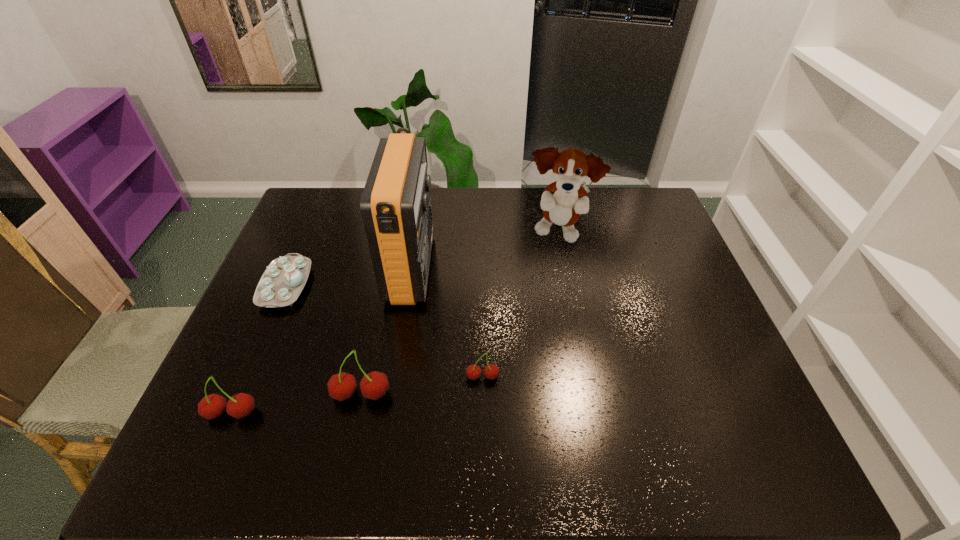
The height and width of the screenshot is (540, 960). Identify the location of vacant space located 0.400m on the front-facing side of the radio receiver. (564, 268).

The image size is (960, 540). Find the location of `vacant space located 0.050m on the right of the chinaware`. vacant space located 0.050m on the right of the chinaware is located at coordinates pyautogui.click(x=326, y=285).

You are a GUI agent. You are given a task and a screenshot of the screen. Output one action in this format:
    pyautogui.click(x=<x>, y=<y>)
    Task: Click on the object located at the far edge
    This screenshot has height=540, width=960.
    Given the screenshot: What is the action you would take?
    pyautogui.click(x=562, y=202)

Find the location of a particular element. cherry present at the left edge is located at coordinates (241, 405).

This screenshot has height=540, width=960. Identify the location of chinaware that is at the left edge. (282, 282).

Identify the location of object at the near left corner. The height and width of the screenshot is (540, 960). (241, 405).

At what (x,y) coordinates should I click in order to perform the action: click on blank area at the far edge. Please return your answer as a coordinate pair (x, y). The height and width of the screenshot is (540, 960). Looking at the image, I should click on (581, 228).

At what (x,y) coordinates should I click in order to perform the action: click on free space at the near edge. Please return your answer as a coordinate pair (x, y). Image resolution: width=960 pixels, height=540 pixels. Looking at the image, I should click on (323, 404).

Find the location of `vacant space at the left edge of the desktop`. vacant space at the left edge of the desktop is located at coordinates (278, 329).

Find the location of a particular element. free space at the right edge of the desktop is located at coordinates (670, 284).